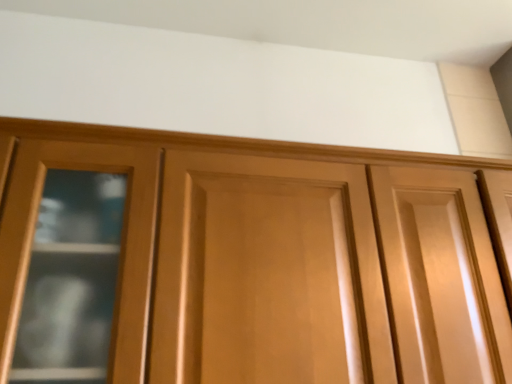
What is the approximate width of matte wood cupboard at center?

matte wood cupboard at center is 14.27 inches in width.

You are a GUI agent. You are given a task and a screenshot of the screen. Output one action in this format:
    pyautogui.click(x=<x>, y=<y>)
    Task: Click on the matte wood cupboard at center
    The image size is (512, 384).
    Given the screenshot: What is the action you would take?
    275,258

What do you see at coordinates (275, 258) in the screenshot? I see `matte wood cupboard at center` at bounding box center [275, 258].

The height and width of the screenshot is (384, 512). In order to click on matte wood cupboard at center in this screenshot , I will do `click(275, 258)`.